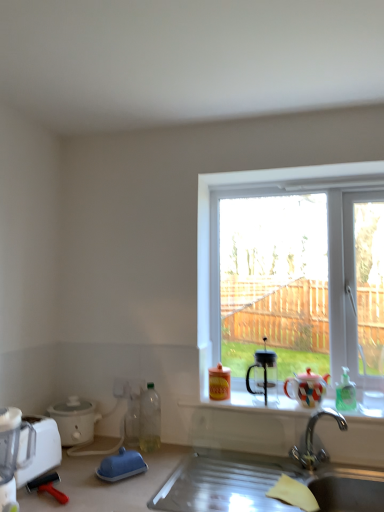
Locate an element on the screen. green translucent bottle at right, positioned as the 3th bottle in left-to-right order is located at coordinates (345, 393).

Is translucent plastic bottle at lower left, placed as the 1th bottle when sorted from left to right, bigger than matte ceramic teapot at window?

Actually, translucent plastic bottle at lower left, placed as the 1th bottle when sorted from left to right, might be smaller than matte ceramic teapot at window.

In the scene shown: Is translucent plastic bottle at lower left, placed as the 1th bottle when sorted from left to right, far away from matte ceramic teapot at window?

They are positioned close to each other.

From the image's perspective, which object appears higher, translucent plastic bottle at lower left, arranged as the 3th bottle when viewed from the right, or matte ceramic teapot at window?

matte ceramic teapot at window.

From a real-world perspective, is translucent plastic bottle at lower left, placed as the 1th bottle when sorted from left to right, above or below matte ceramic teapot at window?

translucent plastic bottle at lower left, placed as the 1th bottle when sorted from left to right, is below matte ceramic teapot at window.

Does white plastic blender at lower left appear on the right side of transparent glass coffee maker at window?

No, white plastic blender at lower left is not to the right of transparent glass coffee maker at window.

From the image's perspective, is white plastic blender at lower left on transparent glass coffee maker at window?

No, from the image's perspective, white plastic blender at lower left is not on top of transparent glass coffee maker at window.

Is white plastic blender at lower left directly adjacent to transparent glass coffee maker at window?

They are not placed beside each other.

Is there a large distance between matte ceramic cups at center and metallic stainless steel sink at lower center?

No, there isn't a large distance between matte ceramic cups at center and metallic stainless steel sink at lower center.

From the image's perspective, is matte ceramic cups at center positioned above or below metallic stainless steel sink at lower center?

matte ceramic cups at center is situated higher than metallic stainless steel sink at lower center in the image.

Does point (185, 404) appear closer or farther from the camera than point (150, 492)?

Clearly, point (185, 404) is more distant from the camera than point (150, 492).

Is matte ceramic cups at center to the left of metallic stainless steel sink at lower center from the viewer's perspective?

Incorrect, matte ceramic cups at center is not on the left side of metallic stainless steel sink at lower center.

Which object is more forward, matte ceramic teapot at window or translucent plastic bottle at lower left, arranged as the 3th bottle when viewed from the right?

matte ceramic teapot at window is more forward.

Which object is positioned more to the right, matte ceramic teapot at window or translucent plastic bottle at lower left, arranged as the 3th bottle when viewed from the right?

Positioned to the right is matte ceramic teapot at window.

Considering the points (322, 390) and (147, 394), which point is behind, point (322, 390) or point (147, 394)?

The point (147, 394) is behind.

Is translucent plastic bottle at lower left, placed as the 1th bottle when sorted from left to right, at the back of matte ceramic teapot at window?

matte ceramic teapot at window does not have its back to translucent plastic bottle at lower left, placed as the 1th bottle when sorted from left to right.

Between silver metallic faucet at lower center and transparent glass window at upper center, which one is positioned in front?

silver metallic faucet at lower center.

I want to click on window located above the silver metallic faucet at lower center (from the image's perspective), so click(x=249, y=187).

Consider the image. From the image's perspective, between silver metallic faucet at lower center and transparent glass window at upper center, who is located below?

silver metallic faucet at lower center appears lower in the image.

Who is taller, silver metallic faucet at lower center or transparent glass window at upper center?

With more height is transparent glass window at upper center.

From a real-world perspective, which is physically below, blue rubber squeegee at lower left, which ranks as the third appliance in left-to-right order, or white matte slow cooker at lower left, which is the second appliance from right to left?

blue rubber squeegee at lower left, which ranks as the third appliance in left-to-right order, from a real-world perspective.

Considering the positions of point (137, 455) and point (92, 431), is point (137, 455) closer or farther from the camera than point (92, 431)?

Clearly, point (137, 455) is closer to the camera than point (92, 431).

Considering the relative sizes of blue rubber squeegee at lower left, which is counted as the 2th appliance, starting from the back, and white matte slow cooker at lower left, which is the second appliance from right to left, in the image provided, is blue rubber squeegee at lower left, which is counted as the 2th appliance, starting from the back, thinner than white matte slow cooker at lower left, which is the second appliance from right to left,?

Indeed, blue rubber squeegee at lower left, which is counted as the 2th appliance, starting from the back, has a lesser width compared to white matte slow cooker at lower left, which is the second appliance from right to left.

Consider the image. Can you tell me how much blue rubber squeegee at lower left, arranged as the first appliance when viewed from the right, and white matte slow cooker at lower left, the 3th appliance from the front, differ in facing direction?

The angle between the facing direction of blue rubber squeegee at lower left, arranged as the first appliance when viewed from the right, and the facing direction of white matte slow cooker at lower left, the 3th appliance from the front, is 29.6 degrees.

From a real-world perspective, is white plastic blender at lower left on top of matte ceramic teapot at window?

No, from a real-world perspective, white plastic blender at lower left is not over matte ceramic teapot at window

Which is in front, point (6, 441) or point (293, 391)?

The point (6, 441) is more forward.

Consider the image. What's the angular difference between white plastic blender at lower left and matte ceramic teapot at window's facing directions?

The facing directions of white plastic blender at lower left and matte ceramic teapot at window are 88.8 degrees apart.

Is white plastic blender at lower left inside or outside of matte ceramic teapot at window?

white plastic blender at lower left is outside matte ceramic teapot at window.

The height and width of the screenshot is (512, 384). What are the coordinates of `tea pot above the translucent plastic bottle at lower left, placed as the 1th bottle when sorted from left to right (from a real-world perspective)` in the screenshot? It's located at (306, 388).

You are a GUI agent. You are given a task and a screenshot of the screen. Output one action in this format:
    pyautogui.click(x=<x>, y=<y>)
    Task: Click on the blender that appears on the left of transparent glass coffee maker at window
    
    Given the screenshot: What is the action you would take?
    pyautogui.click(x=12, y=454)

Considering their positions, is metallic stainless steel sink at lower center positioned further to blue rubber squeegee at lower left, arranged as the first appliance when viewed from the right, than transparent glass window at upper center?

transparent glass window at upper center.

Based on their spatial positions, is matte ceramic teapot at window or translucent plastic bottle at lower left, arranged as the 3th bottle when viewed from the right, closer to white matte slow cooker at lower left, arranged as the 2th appliance when viewed from the left?

translucent plastic bottle at lower left, arranged as the 3th bottle when viewed from the right, is positioned closer to the anchor white matte slow cooker at lower left, arranged as the 2th appliance when viewed from the left.

Looking at the image, which one is located further to matte ceramic cups at center, white matte slow cooker at lower left, which is the second appliance from right to left, or translucent plastic bottle at lower left, arranged as the 3th bottle when viewed from the right?

white matte slow cooker at lower left, which is the second appliance from right to left.

Considering their positions, is transparent glass coffee maker at window positioned closer to matte ceramic cups at center than metallic stainless steel sink at lower center?

Among the two, transparent glass coffee maker at window is located nearer to matte ceramic cups at center.

Based on their spatial positions, is translucent plastic bottle at lower left, arranged as the 3th bottle when viewed from the right, or matte yellow plastic bottle at window, acting as the 2th bottle starting from the right, further from white plastic blender at lower left, which is counted as the 1th appliance, starting from the left?

Based on the image, matte yellow plastic bottle at window, acting as the 2th bottle starting from the right, appears to be further to white plastic blender at lower left, which is counted as the 1th appliance, starting from the left.

Looking at the image, which one is located further to white matte slow cooker at lower left, which is the second appliance from right to left, metallic stainless steel sink at lower center or matte yellow plastic bottle at window, the 2th bottle from the left?

matte yellow plastic bottle at window, the 2th bottle from the left, is positioned further to the anchor white matte slow cooker at lower left, which is the second appliance from right to left.

Estimate the real-world distances between objects in this image. Which object is closer to transparent glass coffee maker at window, blue rubber squeegee at lower left, which ranks as the third appliance in left-to-right order, or translucent plastic bottle at lower left, arranged as the 3th bottle when viewed from the right?

The object closer to transparent glass coffee maker at window is translucent plastic bottle at lower left, arranged as the 3th bottle when viewed from the right.

Which object lies nearer to the anchor point white plastic blender at lower left, transparent glass coffee maker at window or metallic stainless steel sink at lower center?

metallic stainless steel sink at lower center is closer to white plastic blender at lower left.

Locate an element on the screen. The image size is (384, 512). window sill located between white plastic blender at lower left and transparent glass window at upper center in the left-right direction is located at coordinates (223, 402).

In order to click on countertop situated between white matte slow cooker at lower left, which is the second appliance from right to left, and transparent glass window at upper center from left to right in this screenshot , I will do `click(116, 484)`.

In order to click on tap between metallic stainless steel sink at lower center and transparent glass coffee maker at window along the z-axis in this screenshot , I will do `click(312, 441)`.

Locate an element on the screen. countertop located between white plastic blender at lower left and matte ceramic teapot at window in the left-right direction is located at coordinates (116, 484).